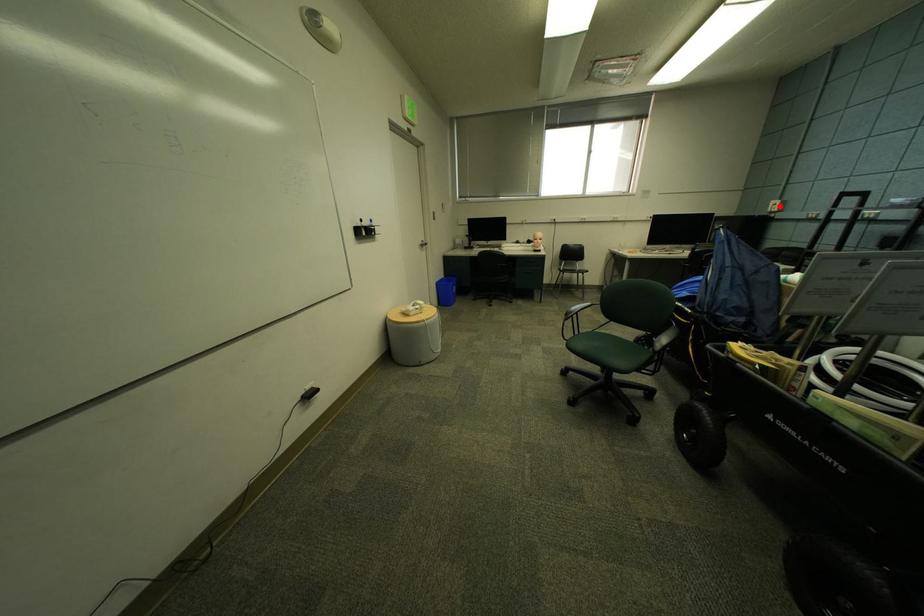
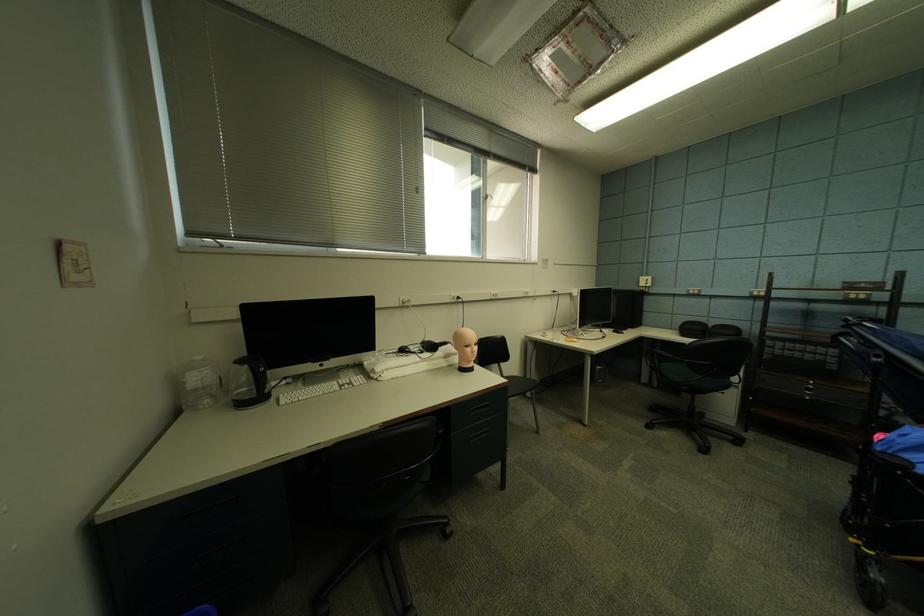
In the second image, find the point that corresponds to the highlighted location in the first image.

(650, 282)